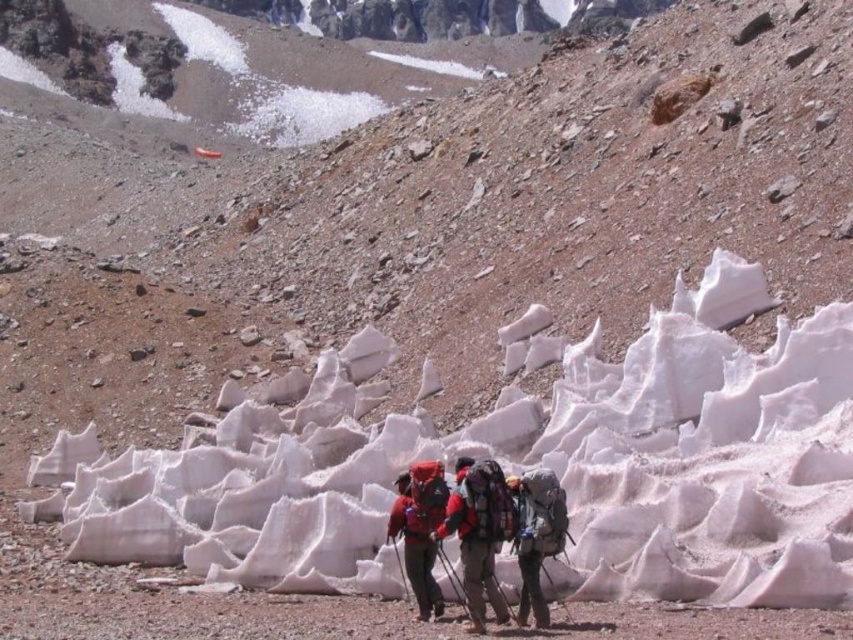
Question: Is matte red jacket at center to the left of matte gray backpack at center from the viewer's perspective?

Choices:
 (A) yes
 (B) no

Answer: (A)

Question: Which object is closer to the camera taking this photo?

Choices:
 (A) matte gray backpack at center
 (B) matte red jacket at center

Answer: (A)

Question: Does red fabric jacket at center appear under matte gray backpack at center?

Choices:
 (A) yes
 (B) no

Answer: (B)

Question: Which point is closer to the camera taking this photo?

Choices:
 (A) (526, 592)
 (B) (498, 525)

Answer: (A)

Question: Among these objects, which one is nearest to the camera?

Choices:
 (A) matte red jacket at center
 (B) matte gray backpack at center

Answer: (B)

Question: Does red fabric jacket at center appear on the right side of matte red jacket at center?

Choices:
 (A) no
 (B) yes

Answer: (B)